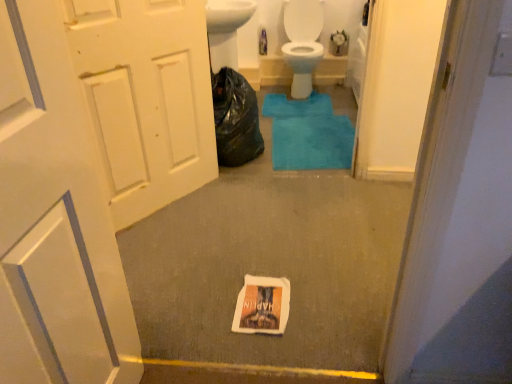
This screenshot has height=384, width=512. I want to click on free location to the right of black plastic bag at center, so click(x=291, y=141).